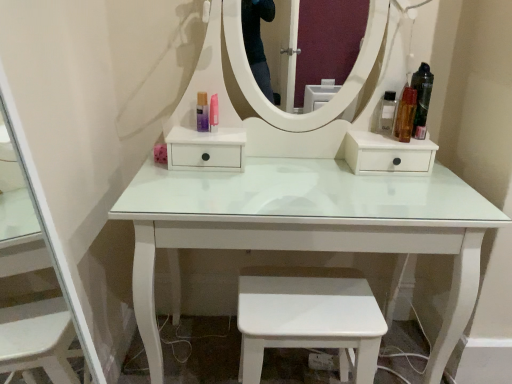
Question: Is translucent purple bottle at center, arranged as the 5th toiletry when viewed from the right, to the right of translucent amber bottle at right, which appears as the 4th toiletry when viewed from the left, from the viewer's perspective?

Choices:
 (A) yes
 (B) no

Answer: (B)

Question: Considering the relative sizes of translucent purple bottle at center, arranged as the 5th toiletry when viewed from the right, and translucent amber bottle at right, which appears as the 4th toiletry when viewed from the left, in the image provided, is translucent purple bottle at center, arranged as the 5th toiletry when viewed from the right, shorter than translucent amber bottle at right, which appears as the 4th toiletry when viewed from the left,?

Choices:
 (A) yes
 (B) no

Answer: (A)

Question: Considering the relative sizes of translucent purple bottle at center, arranged as the first toiletry when viewed from the left, and translucent amber bottle at right, the 2th toiletry viewed from the right, in the image provided, is translucent purple bottle at center, arranged as the first toiletry when viewed from the left, wider than translucent amber bottle at right, the 2th toiletry viewed from the right,?

Choices:
 (A) yes
 (B) no

Answer: (B)

Question: From the image's perspective, is translucent purple bottle at center, arranged as the first toiletry when viewed from the left, located beneath translucent amber bottle at right, the 2th toiletry viewed from the right?

Choices:
 (A) yes
 (B) no

Answer: (B)

Question: Is translucent purple bottle at center, arranged as the first toiletry when viewed from the left, far from translucent amber bottle at right, the 2th toiletry viewed from the right?

Choices:
 (A) yes
 (B) no

Answer: (B)

Question: Is translucent purple bottle at center, arranged as the first toiletry when viewed from the left, turned away from translucent amber bottle at right, which appears as the 4th toiletry when viewed from the left?

Choices:
 (A) yes
 (B) no

Answer: (B)

Question: Is translucent amber bottle at right, which appears as the 4th toiletry when viewed from the left, far from pink glossy lipstick at center, which is the fourth toiletry in right-to-left order?

Choices:
 (A) no
 (B) yes

Answer: (A)

Question: Considering the relative sizes of translucent amber bottle at right, the 2th toiletry viewed from the right, and pink glossy lipstick at center, which is the fourth toiletry in right-to-left order, in the image provided, is translucent amber bottle at right, the 2th toiletry viewed from the right, bigger than pink glossy lipstick at center, which is the fourth toiletry in right-to-left order,?

Choices:
 (A) yes
 (B) no

Answer: (A)

Question: Is translucent amber bottle at right, the 2th toiletry viewed from the right, touching pink glossy lipstick at center, which is the fourth toiletry in right-to-left order?

Choices:
 (A) yes
 (B) no

Answer: (B)

Question: Considering the relative sizes of translucent amber bottle at right, which appears as the 4th toiletry when viewed from the left, and pink glossy lipstick at center, which is counted as the 2th toiletry, starting from the left, in the image provided, is translucent amber bottle at right, which appears as the 4th toiletry when viewed from the left, wider than pink glossy lipstick at center, which is counted as the 2th toiletry, starting from the left,?

Choices:
 (A) no
 (B) yes

Answer: (B)

Question: From a real-world perspective, is translucent amber bottle at right, which appears as the 4th toiletry when viewed from the left, beneath pink glossy lipstick at center, which is counted as the 2th toiletry, starting from the left?

Choices:
 (A) yes
 (B) no

Answer: (B)

Question: Would you say translucent amber bottle at right, the 2th toiletry viewed from the right, contains pink glossy lipstick at center, which is the fourth toiletry in right-to-left order?

Choices:
 (A) no
 (B) yes

Answer: (A)

Question: Is pink glossy lipstick at center, which is counted as the 2th toiletry, starting from the left, in front of white glossy step stool at lower center?

Choices:
 (A) no
 (B) yes

Answer: (A)